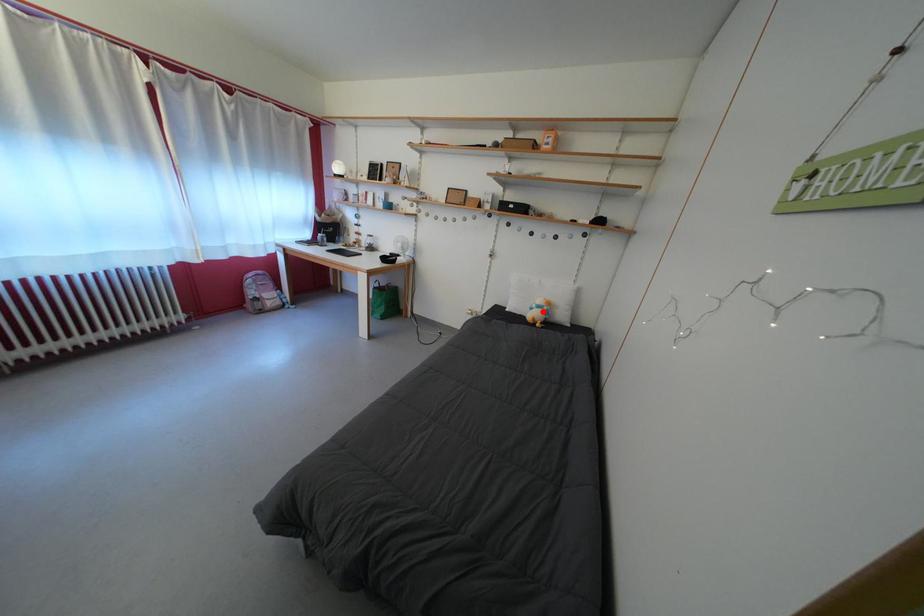
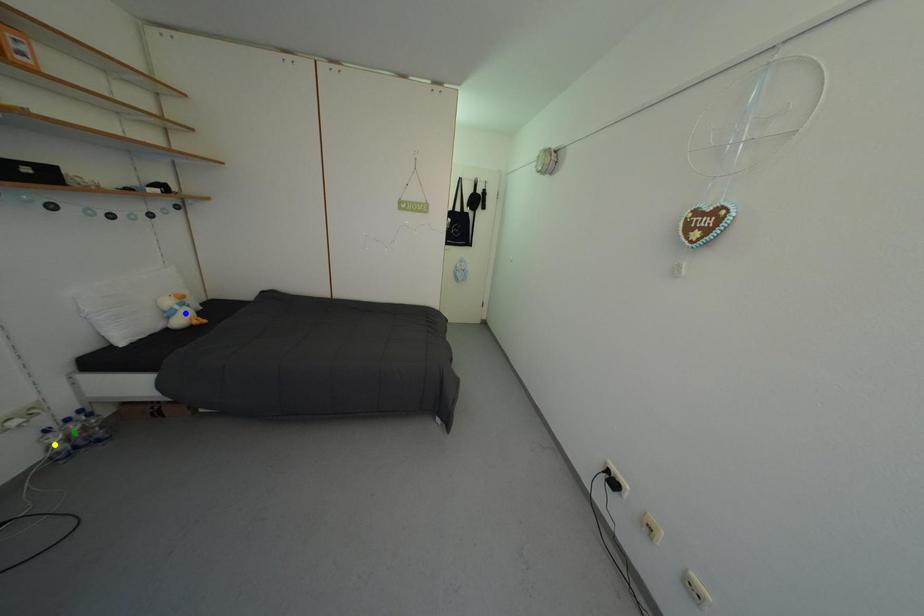
Question: I am providing you with two images of the same scene from different viewpoints. A red point is marked on the first image. You are given multiple points on the second image. Which mark in image 2 goes with the point in image 1?

Choices:
 (A) yellow point
 (B) green point
 (C) blue point

Answer: (C)